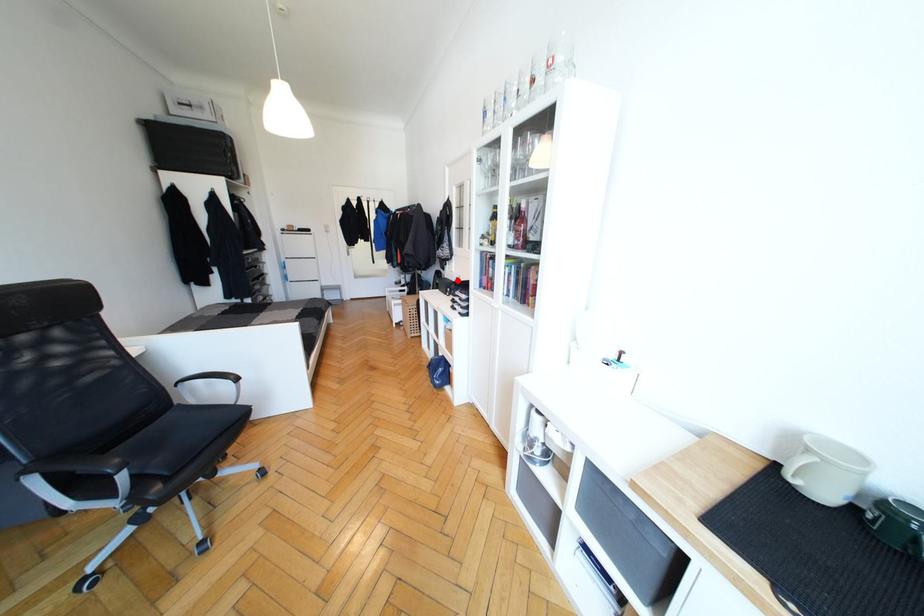
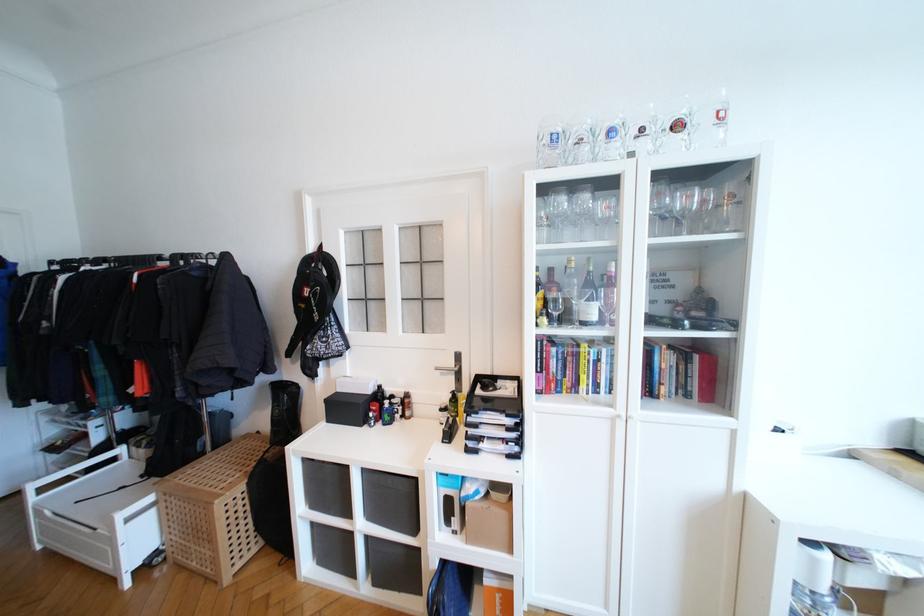
Locate, in the second image, the point that corresponds to the highlighted location in the first image.

(372, 392)